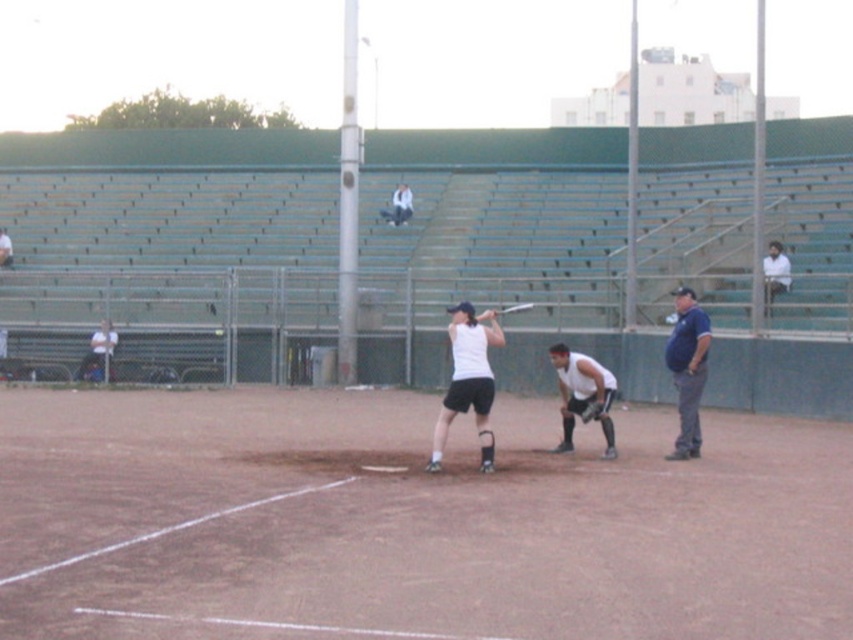
Question: Which point is closer to the camera?

Choices:
 (A) brown dirt field at center
 (B) metallic silver bat at center
 (C) brown leather glove at lower center

Answer: (A)

Question: Does blue shirt at right appear under brown leather glove at lower center?

Choices:
 (A) no
 (B) yes

Answer: (A)

Question: Which of the following is the closest to the observer?

Choices:
 (A) (514, 305)
 (B) (582, 358)

Answer: (B)

Question: Is brown dirt field at center bigger than white sleeveless shirt at center?

Choices:
 (A) no
 (B) yes

Answer: (B)

Question: Which point is closer to the camera?

Choices:
 (A) (508, 307)
 (B) (488, 314)

Answer: (B)

Question: Does brown dirt field at center appear on the left side of white shirt at upper right?

Choices:
 (A) no
 (B) yes

Answer: (B)